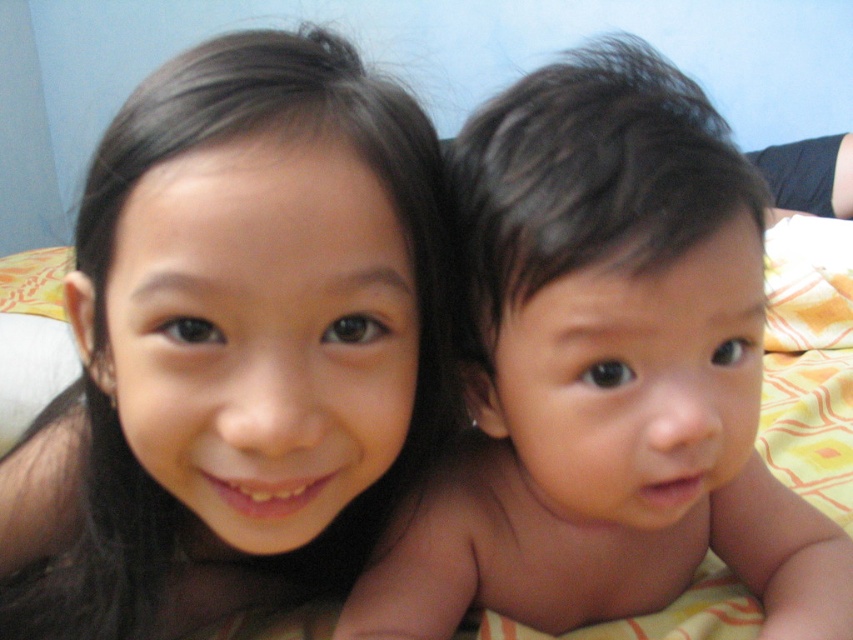
Is smooth skin girl at center above smooth skin baby at center?

Incorrect, smooth skin girl at center is not positioned above smooth skin baby at center.

Which is below, smooth skin girl at center or smooth skin baby at center?

Positioned lower is smooth skin girl at center.

Where is `smooth skin girl at center`? This screenshot has width=853, height=640. smooth skin girl at center is located at coordinates (247, 337).